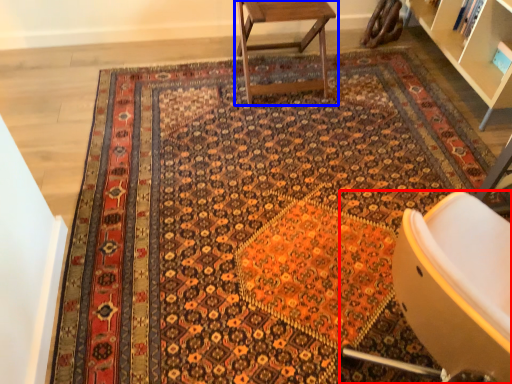
Question: Which point is further to the camera, chair (highlighted by a red box) or table (highlighted by a blue box)?

Choices:
 (A) chair
 (B) table

Answer: (B)